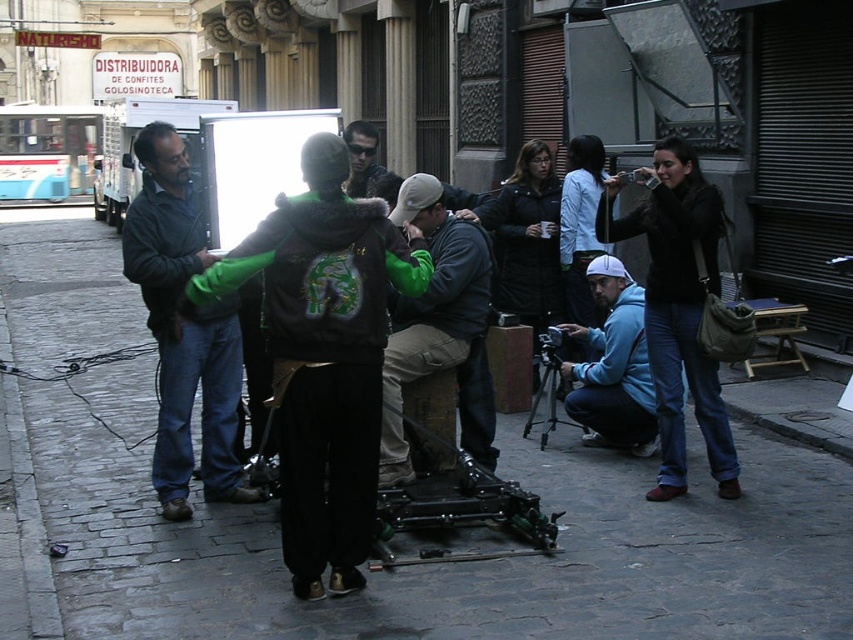
Question: Which point is farther from the camera taking this photo?

Choices:
 (A) (546, 356)
 (B) (614, 276)
 (C) (259, 490)

Answer: (A)

Question: Is green fuzzy jacket at center thinner than green fabric jacket at center?

Choices:
 (A) yes
 (B) no

Answer: (B)

Question: Which object is positioned farthest from the dark blue jeans at center?

Choices:
 (A) dark gray cobblestone at center
 (B) black leather jacket at center
 (C) green fuzzy jacket at center

Answer: (B)

Question: Which is farther from the black matte tripod at center?

Choices:
 (A) dark blue jeans at center
 (B) blue fleece jacket at lower right
 (C) black leather jacket at center

Answer: (A)

Question: Can you confirm if green fuzzy jacket at center is positioned to the left of black leather jacket at center?

Choices:
 (A) yes
 (B) no

Answer: (A)

Question: Does black leather jacket at center come behind matte black jacket at center?

Choices:
 (A) yes
 (B) no

Answer: (B)